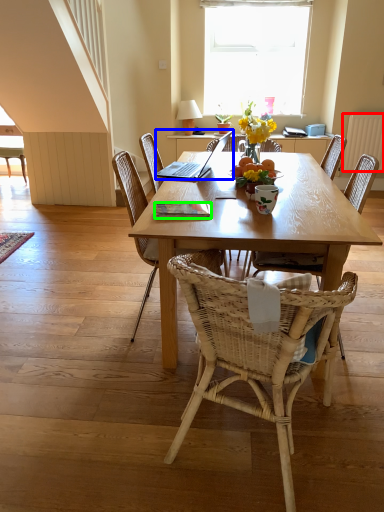
Question: Considering the real-world distances, which object is closest to radiator (highlighted by a red box)? laptop (highlighted by a blue box) or book (highlighted by a green box).

Choices:
 (A) laptop
 (B) book

Answer: (A)